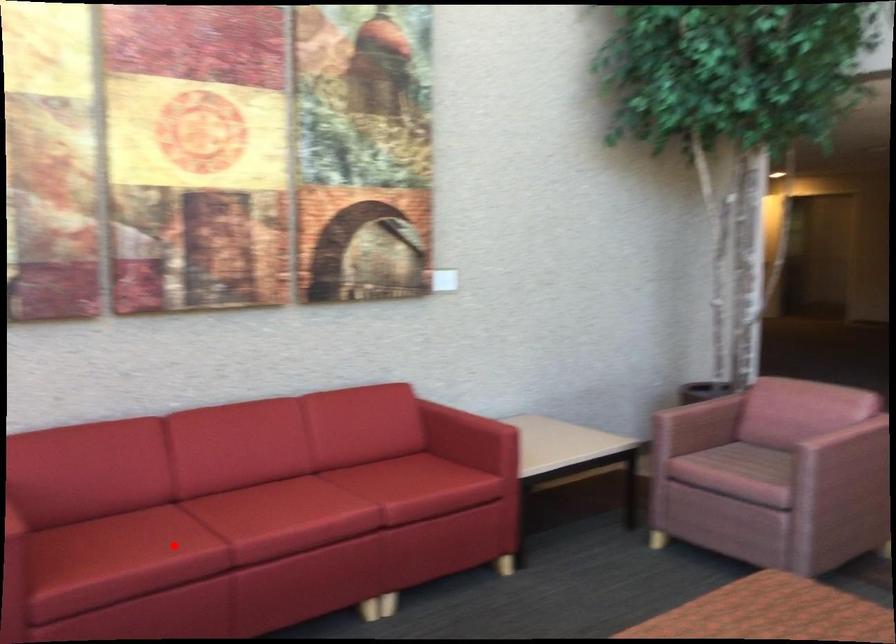
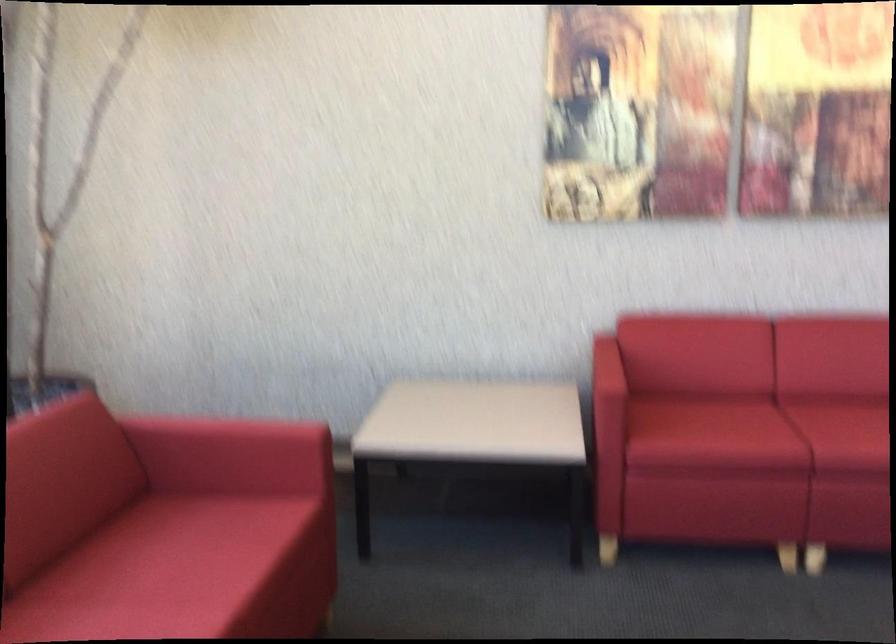
In the second image, find the point that corresponds to the highlighted location in the first image.

(757, 431)